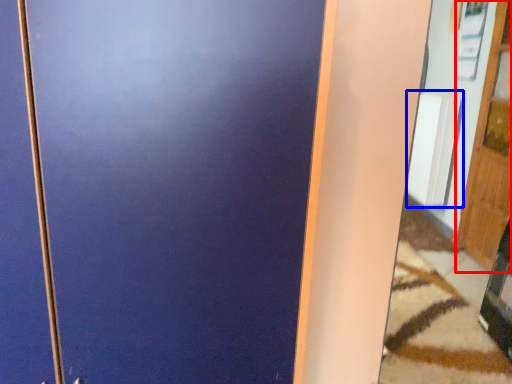
Question: Among these objects, which one is farthest to the camera, door (highlighted by a red box) or radiator (highlighted by a blue box)?

Choices:
 (A) door
 (B) radiator

Answer: (B)